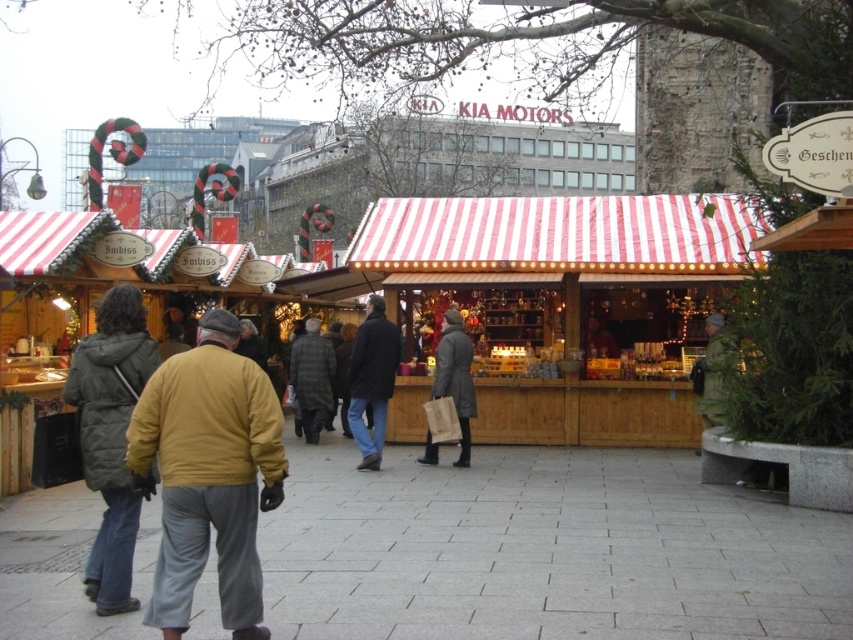
Measure the distance between plaid fabric jacket at center and dark brown leather jacket at center.

plaid fabric jacket at center is 4.64 meters away from dark brown leather jacket at center.

Who is lower down, plaid fabric jacket at center or dark brown leather jacket at center?

Positioned lower is plaid fabric jacket at center.

I want to click on plaid fabric jacket at center, so click(x=312, y=378).

Is plaid fabric jacket at center positioned at the back of matte gray jacket at center?

Yes, plaid fabric jacket at center is behind matte gray jacket at center.

Which is in front, point (305, 332) or point (462, 362)?

Point (462, 362)

Who is more forward, (316, 416) or (436, 387)?

Positioned in front is point (436, 387).

This screenshot has width=853, height=640. I want to click on plaid fabric jacket at center, so click(312, 378).

Is dark brown leather jacket at center smaller than matte gray jacket at center?

Incorrect, dark brown leather jacket at center is not smaller in size than matte gray jacket at center.

Can you confirm if dark brown leather jacket at center is wider than matte gray jacket at center?

Correct, the width of dark brown leather jacket at center exceeds that of matte gray jacket at center.

Who is more distant from viewer, (392,358) or (473,408)?

Point (392,358)

Where is `dark brown leather jacket at center`? This screenshot has height=640, width=853. dark brown leather jacket at center is located at coordinates (374, 358).